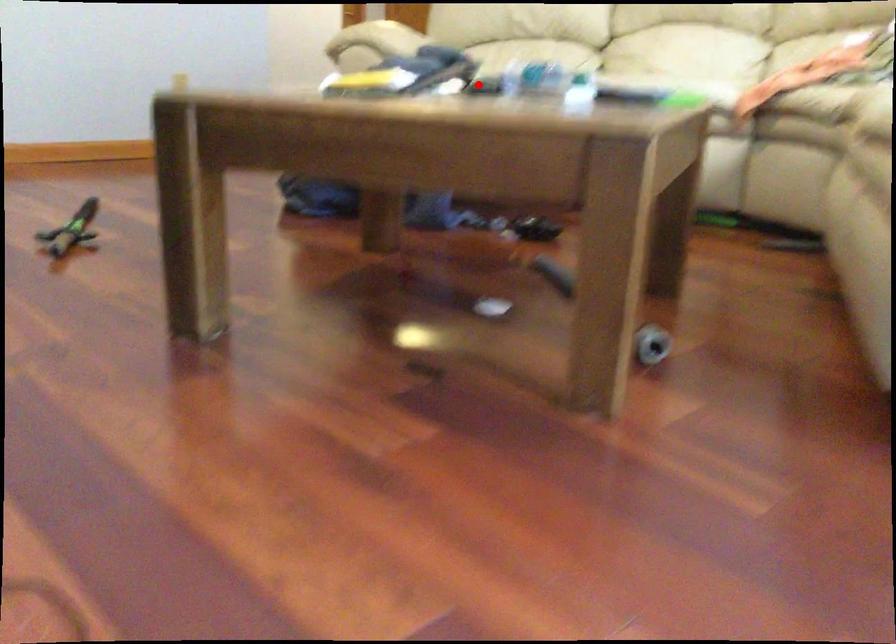
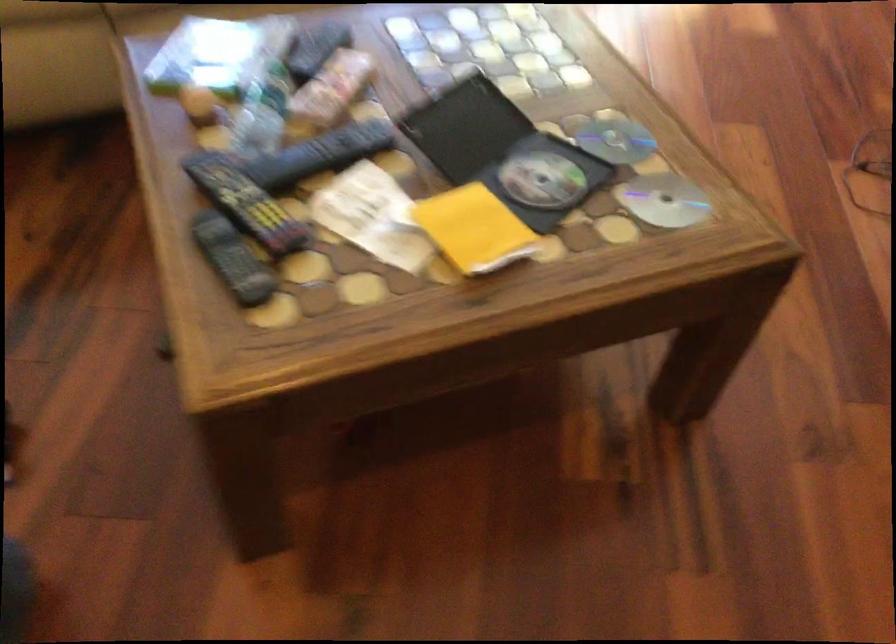
Question: A red point is marked in image1. In image2, is the corresponding 3D point closer to the camera or farther? Reply with the corresponding letter.

Choices:
 (A) The corresponding 3D point is closer.
 (B) The corresponding 3D point is farther.

Answer: (A)